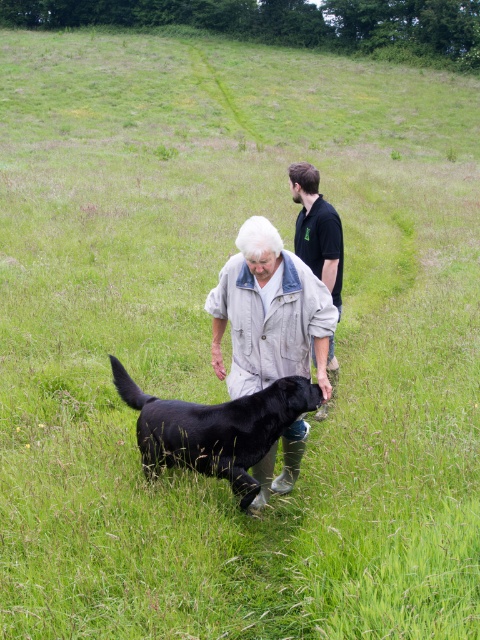
Consider the image. You are a photographer trying to capture a clear photo of both the light beige denim jacket at center and the black shirt at center. Since you want both to be visible, which object should you focus on first to ensure the other remains in focus?

The light beige denim jacket at center is smaller than the black shirt at center. To ensure both are in focus, you should focus on the black shirt at center first because it is larger and more prominent, making it easier to capture clearly while the smaller light beige denim jacket at center will still be within the depth of field.

You are a photographer positioned at the edge of the field. You want to take a photo that includes both the light beige denim jacket at center and the black shirt at center. Which object should you focus on first to ensure both are in sharp focus?

You should focus on the light beige denim jacket at center first because it is closer to the viewer than the black shirt at center, so focusing on the closer object will help ensure both are in focus.

You are a photographer trying to capture a closeup of the shiny black dog at center. You notice the light beige denim jacket at center is blocking your view. Can you suggest a way to adjust your position to avoid the jacket?

Since the light beige denim jacket at center is larger than the shiny black dog at center, moving slightly to the side of the jacket might allow you to frame the dog without obstruction.